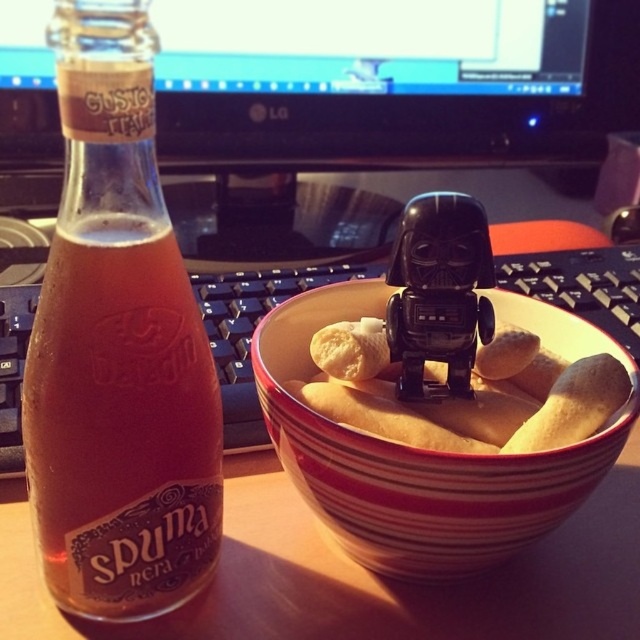
Question: From the image, what is the correct spatial relationship of yellow matte bread at center in relation to black plastic toy at center?

Choices:
 (A) below
 (B) above

Answer: (A)

Question: Among these points, which one is farthest from the camera?

Choices:
 (A) (472, 356)
 (B) (104, 188)

Answer: (A)

Question: Which object appears closest to the camera in this image?

Choices:
 (A) yellow matte bread at center
 (B) translucent glass bottle at left
 (C) black plastic toy at center

Answer: (B)

Question: Does translucent glass bottle at left have a smaller size compared to yellow matte bread at center?

Choices:
 (A) no
 (B) yes

Answer: (A)

Question: Which object appears farthest from the camera in this image?

Choices:
 (A) translucent glass bottle at left
 (B) black plastic toy at center
 (C) striped ceramic bowl at center
 (D) yellow matte bread at center

Answer: (B)

Question: Where is yellow matte bread at center located in relation to black plastic toy at center in the image?

Choices:
 (A) below
 (B) above

Answer: (A)